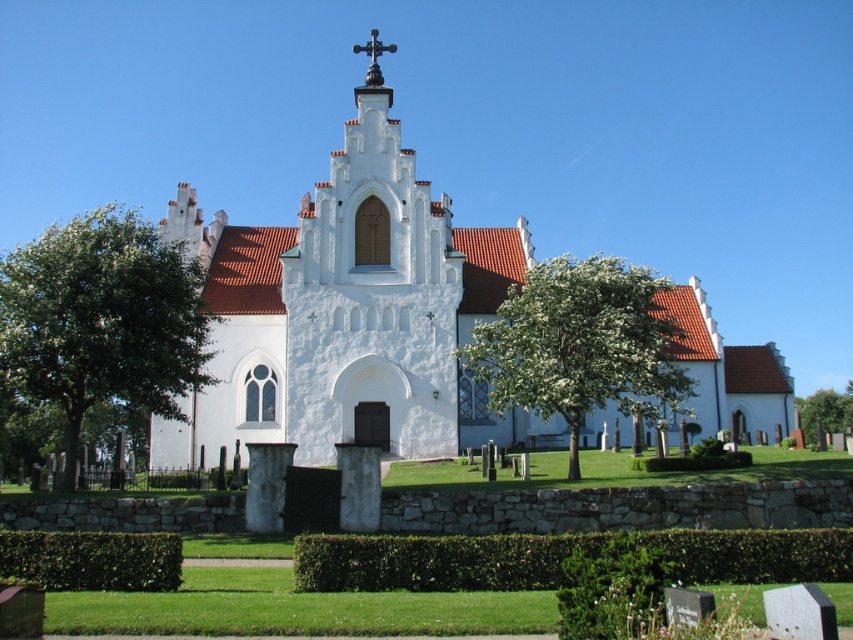
Question: Estimate the real-world distances between objects in this image. Which object is closer to the green leafy hedge at lower left?

Choices:
 (A) white blossoming tree at center
 (B) green leafy tree at center
 (C) green leafy tree at left

Answer: (C)

Question: Which of the following is the closest to the observer?

Choices:
 (A) green leafy tree at left
 (B) green leafy tree at center
 (C) green leafy hedge at lower center

Answer: (C)

Question: Is white blossoming tree at center to the right of green leafy hedge at lower center from the viewer's perspective?

Choices:
 (A) yes
 (B) no

Answer: (A)

Question: Can you confirm if white blossoming tree at center is wider than green leafy hedge at lower center?

Choices:
 (A) yes
 (B) no

Answer: (B)

Question: Which of these objects is positioned farthest from the green leafy hedge at lower left?

Choices:
 (A) green leafy tree at left
 (B) green leafy tree at center
 (C) white stucco church at center

Answer: (B)

Question: Observing the image, what is the correct spatial positioning of white blossoming tree at center in reference to green leafy hedge at lower left?

Choices:
 (A) above
 (B) below

Answer: (A)